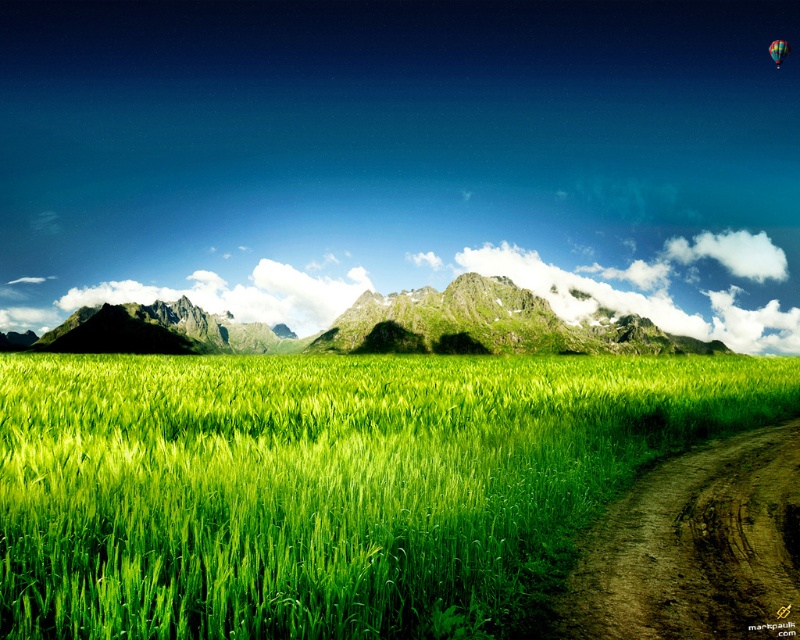
You are standing at the edge of the green grassy wheat field at center and want to walk towards the green grassy mountain at center. Which direction should you walk to get closer to the mountain?

You should walk away from the green grassy wheat field at center towards the direction of the green grassy mountain at center since the wheat field is closer to you than the mountain.

You are an observer standing on the dirt path in the lower right corner. You see the green grassy mountain at center and the multicolored fabric balloon at upper right. Which object appears larger in the scene?

The green grassy mountain at center appears larger than the multicolored fabric balloon at upper right because it is bigger in size according to the description.